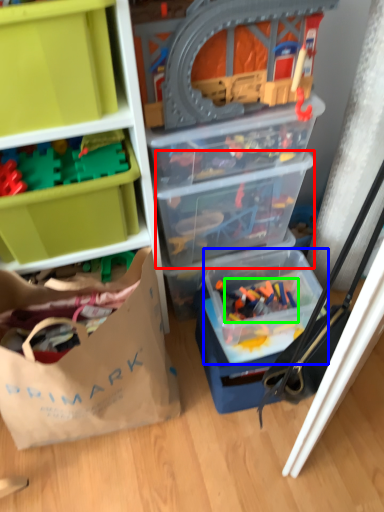
Question: Considering the real-world distances, which object is closest to storage box (highlighted by a red box)? storage box (highlighted by a blue box) or toy (highlighted by a green box).

Choices:
 (A) storage box
 (B) toy

Answer: (A)